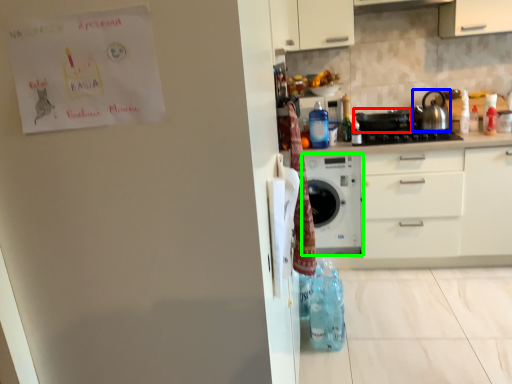
Question: Which is nearer to the appliance (highlighted by a red box)? kitchen appliance (highlighted by a blue box) or home appliance (highlighted by a green box).

Choices:
 (A) kitchen appliance
 (B) home appliance

Answer: (A)